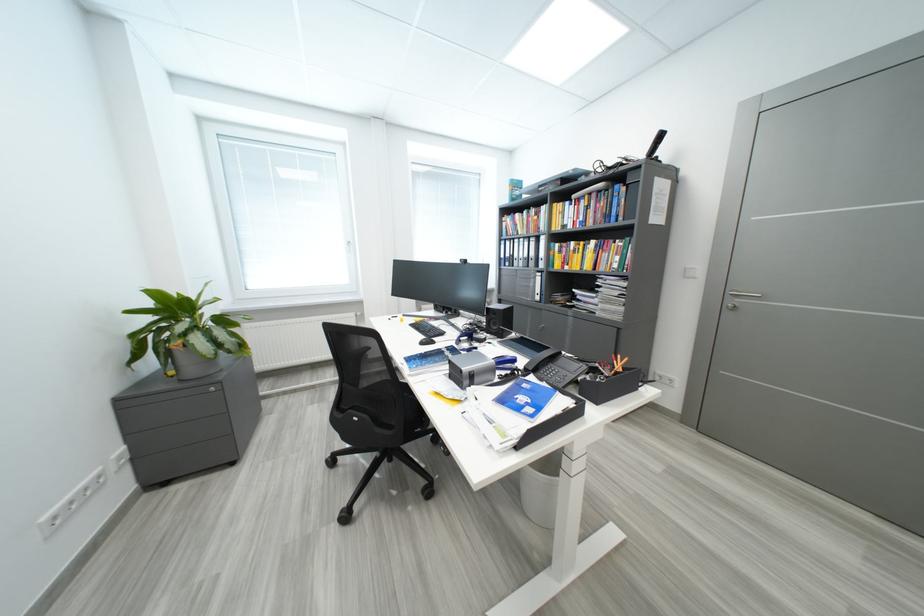
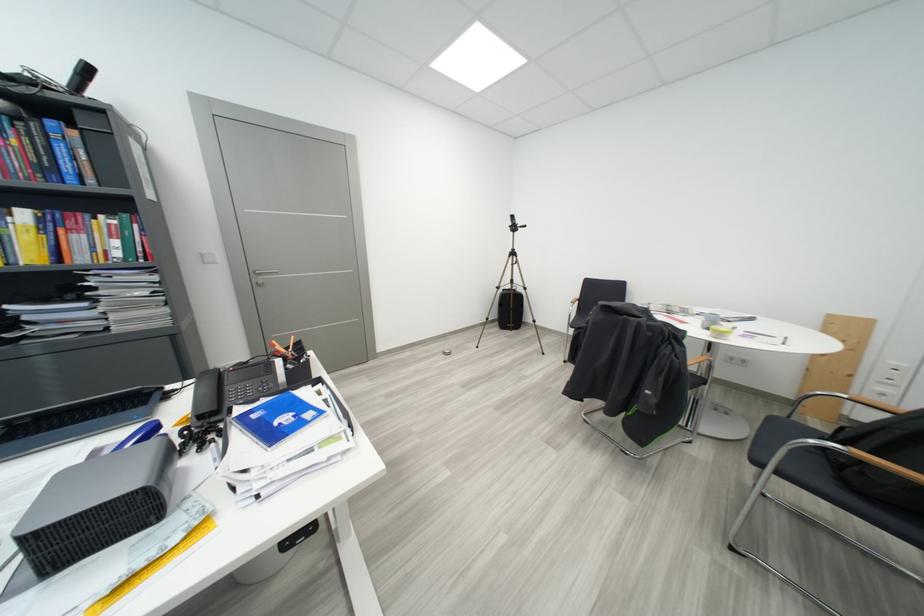
In the second image, find the point that corresponds to pixel 626 261 in the first image.

(126, 245)